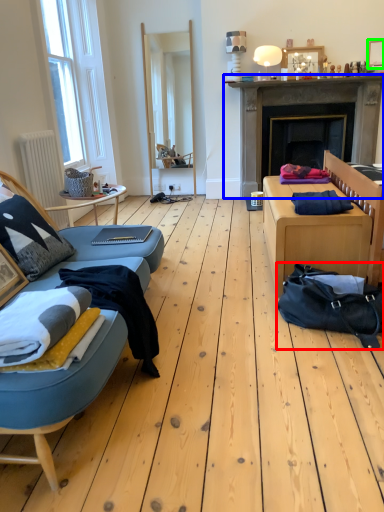
Question: Which object is positioned farthest from bag (highlighted by a red box)? Select from fireplace (highlighted by a blue box) and picture frame (highlighted by a green box).

Choices:
 (A) fireplace
 (B) picture frame

Answer: (B)